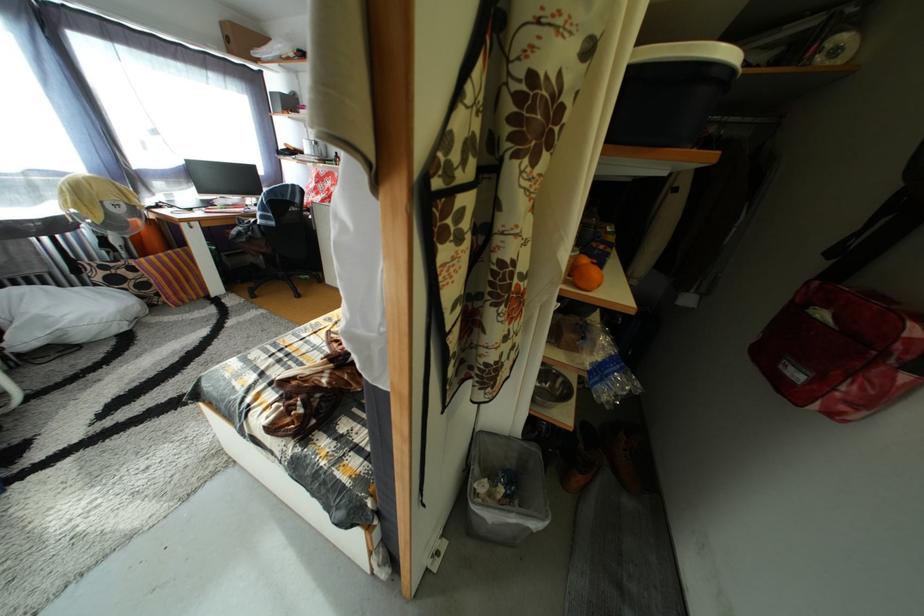
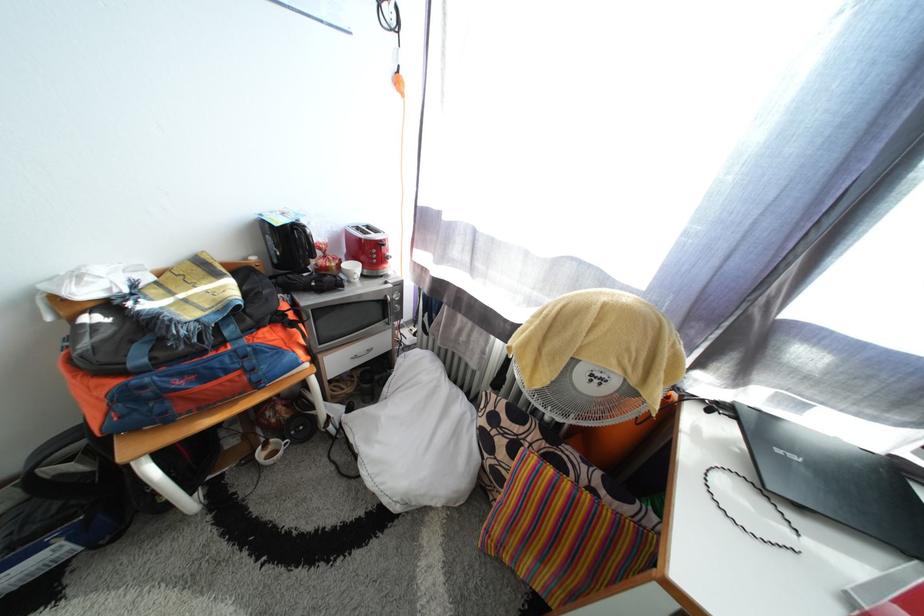
Find the pixel in the second image that matches pixel 167 265 in the first image.

(563, 493)